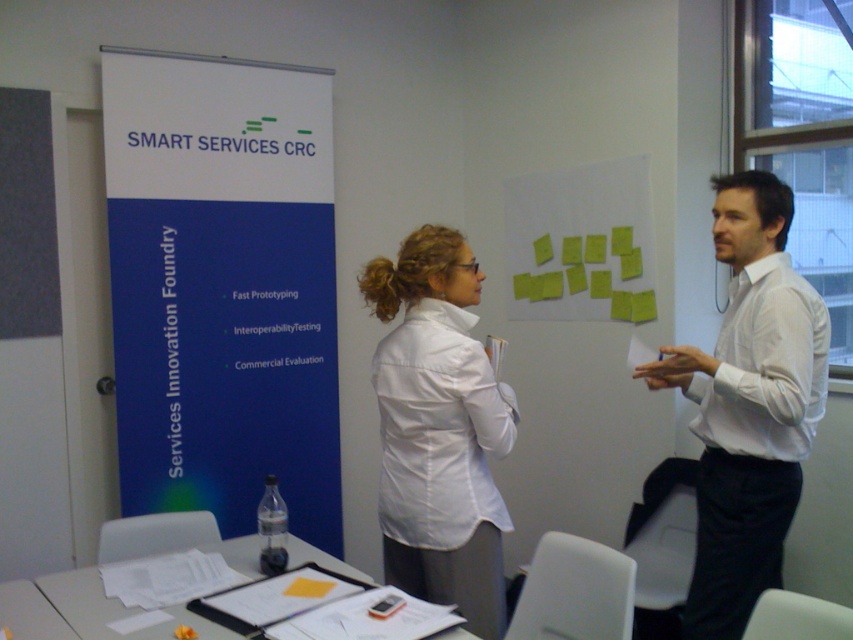
Question: Which point is closer to the camera?

Choices:
 (A) click(x=759, y=536)
 (B) click(x=434, y=436)
 (C) click(x=154, y=176)
 (D) click(x=553, y=316)

Answer: (B)

Question: Which object is positioned farthest from the white shirt at right?

Choices:
 (A) white matte shirt at center
 (B) yellow paper at upper center

Answer: (B)

Question: From the image, what is the correct spatial relationship of white matte shirt at center in relation to yellow paper at upper center?

Choices:
 (A) right
 (B) left

Answer: (B)

Question: Which object is positioned closest to the yellow paper at upper center?

Choices:
 (A) white matte shirt at center
 (B) blue paperboard at center

Answer: (B)

Question: Can you confirm if blue paperboard at center is smaller than white shirt at right?

Choices:
 (A) no
 (B) yes

Answer: (A)

Question: Does blue paperboard at center appear on the left side of yellow paper at upper center?

Choices:
 (A) no
 (B) yes

Answer: (B)